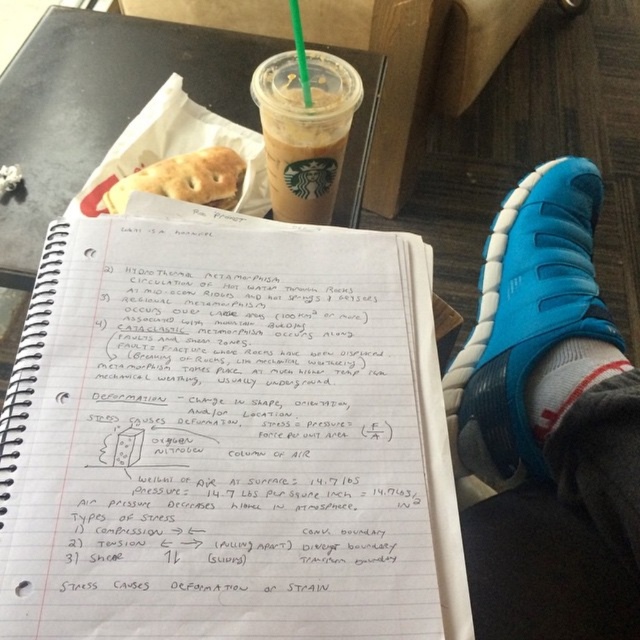
You are at a desk with the notebook and need to reach for either the translucent plastic cup at upper center or the green plastic straw at upper center. Which one is farther from your hand if your hand is currently positioned at the notebook?

The translucent plastic cup at upper center and green plastic straw at upper center are both at upper center, so they are equally distant from your hand at the notebook. However, they are 19.10 inches apart from each other, meaning whichever direction your hand moves, the distance to each would depend on their exact positions relative to the notebook. Since the question specifies your hand is at the notebook, and both objects are at upper center, their distance from the notebook isnecessary to determine, as

You are a student who wants to drink water from the transparent plastic cup at upper center. However, you notice the green plastic straw at upper center is blocking the opening. Can you easily access the cup without moving the straw?

The transparent plastic cup at upper center is positioned on the left side of the green plastic straw at upper center, meaning the straw is actually to the right of the cup. Therefore, the straw isn

Based on the photo, you are a student who needs to drink water quickly. You have a translucent plastic cup at upper center and a green plastic straw at upper center. Which item can you use to drink faster?

The translucent plastic cup at upper center can be used to drink faster because it is taller than the green plastic straw at upper center, allowing for quicker consumption.